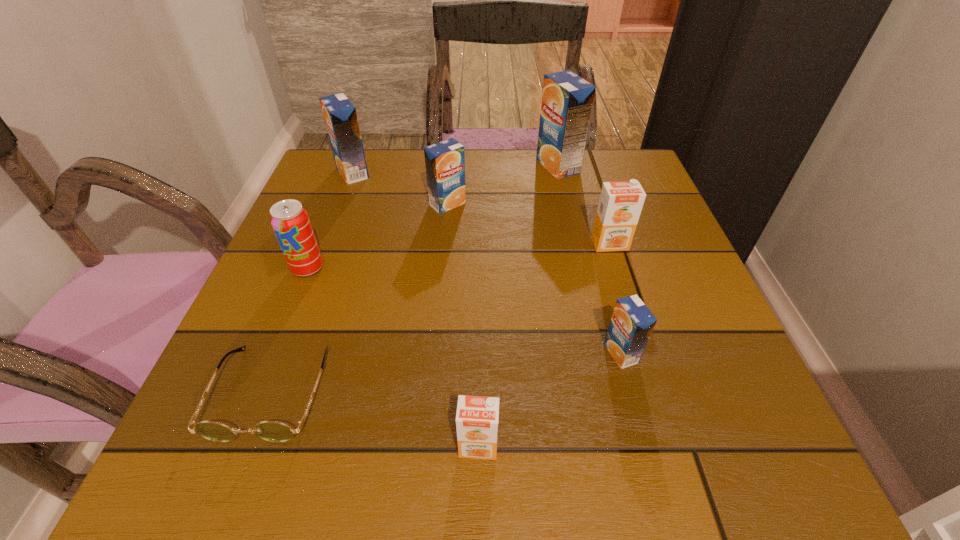
Where is `free space located on the back of the nearest blue orange_juice`? The height and width of the screenshot is (540, 960). free space located on the back of the nearest blue orange_juice is located at coordinates (605, 294).

In order to click on blank space located 0.150m on the left of the smaller orange orange juice in this screenshot , I will do `click(349, 446)`.

What are the coordinates of `orange juice at the near edge` in the screenshot? It's located at (477, 417).

Find the location of a particular element. The width and height of the screenshot is (960, 540). spectacles at the near edge is located at coordinates (273, 431).

Locate an element on the screen. Image resolution: width=960 pixels, height=540 pixels. orange_juice that is at the left edge is located at coordinates (340, 116).

This screenshot has width=960, height=540. In order to click on soda can positioned at the left edge in this screenshot , I will do `click(290, 221)`.

Find the location of `spectacles that is at the left edge`. spectacles that is at the left edge is located at coordinates (273, 431).

Identify the location of object that is at the far left corner. (340, 116).

At what (x,y) coordinates should I click in order to perform the action: click on object located in the near left corner section of the desktop. Please return your answer as a coordinate pair (x, y). Image resolution: width=960 pixels, height=540 pixels. Looking at the image, I should click on (273, 431).

The height and width of the screenshot is (540, 960). I want to click on object located in the far right corner section of the desktop, so click(567, 99).